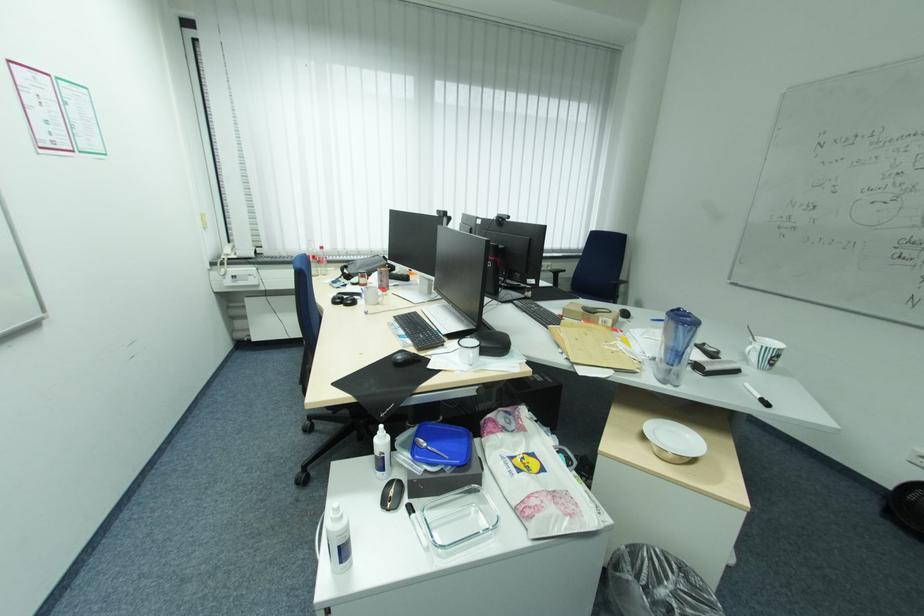
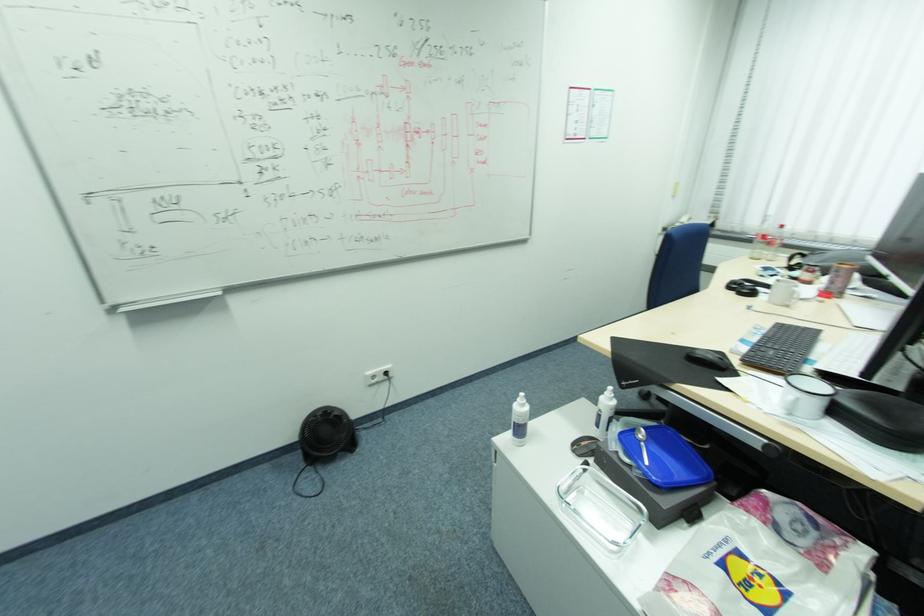
Where in the second image is the point corresponding to point (448, 464) from the first image?

(642, 463)